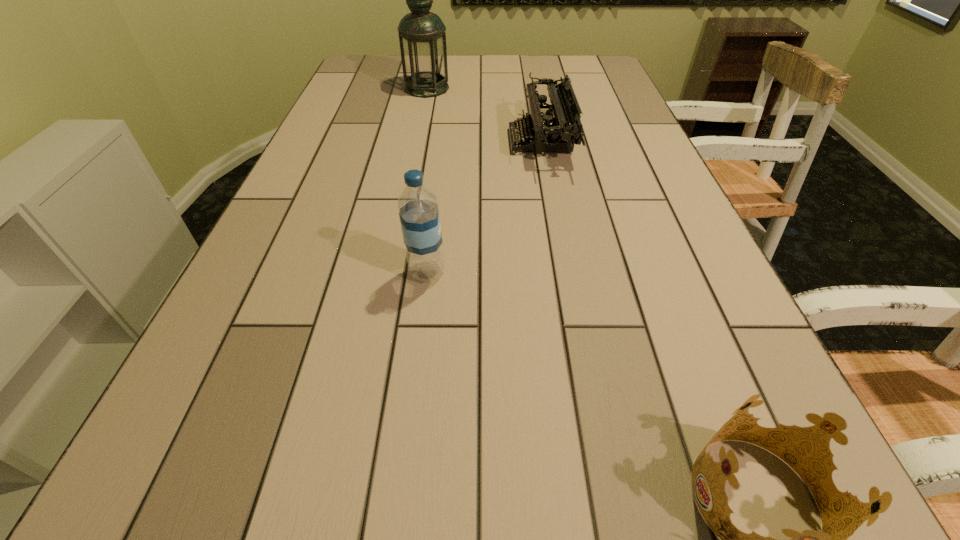
Locate an element on the screen. Image resolution: width=960 pixels, height=540 pixels. the farthest object is located at coordinates (422, 37).

I want to click on oil lamp, so click(x=422, y=37).

In order to click on the second nearest object in this screenshot , I will do `click(418, 210)`.

Find the location of a particular element. Image resolution: width=960 pixels, height=540 pixels. water bottle is located at coordinates (418, 210).

The image size is (960, 540). I want to click on the second farthest object, so click(x=549, y=134).

This screenshot has height=540, width=960. Identify the location of the third object from left to right. [x=549, y=134].

In order to click on vacant space located 0.250m on the front of the tallest object in this screenshot , I will do `click(417, 139)`.

Where is `vacant space located on the label of the third farthest object`? vacant space located on the label of the third farthest object is located at coordinates (550, 272).

Identify the location of free space located 0.370m on the typing side of the typewriter. This screenshot has width=960, height=540. (372, 141).

The width and height of the screenshot is (960, 540). I want to click on vacant space located on the typing side of the typewriter, so click(439, 141).